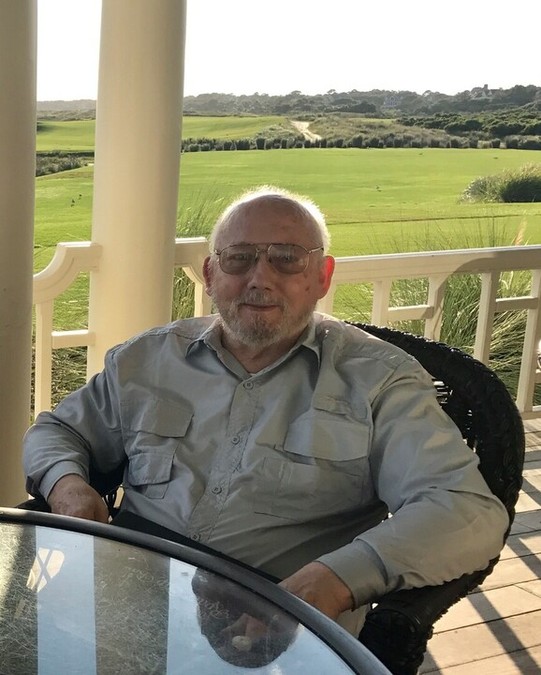
The height and width of the screenshot is (675, 541). What are the coordinates of `right armrest` in the screenshot? It's located at (31, 500).